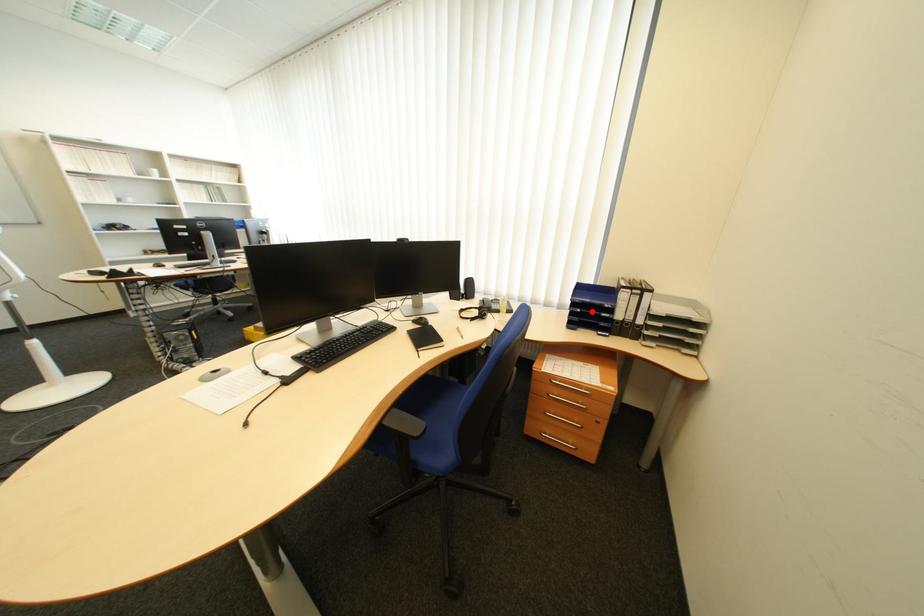
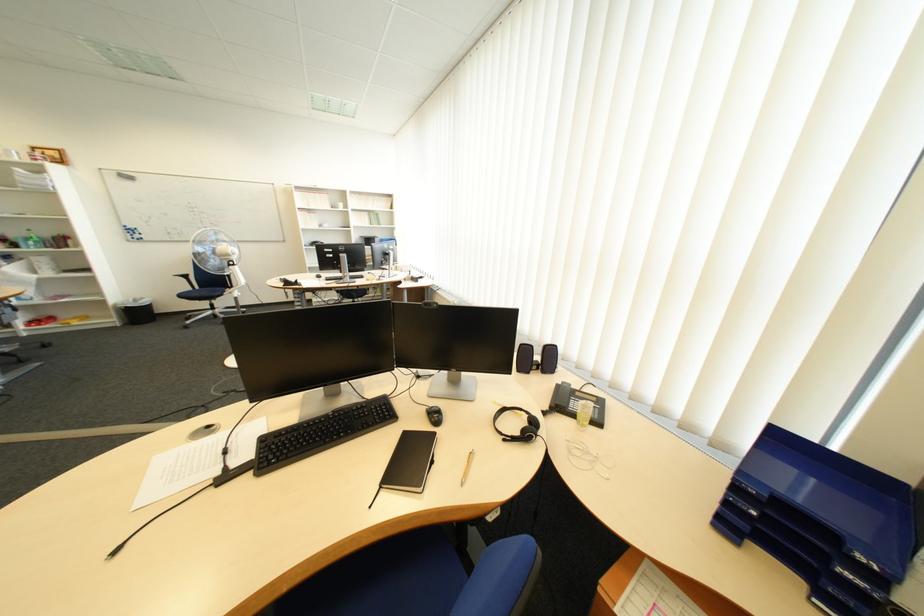
In the second image, find the point that corresponds to the highlighted location in the first image.

(767, 514)